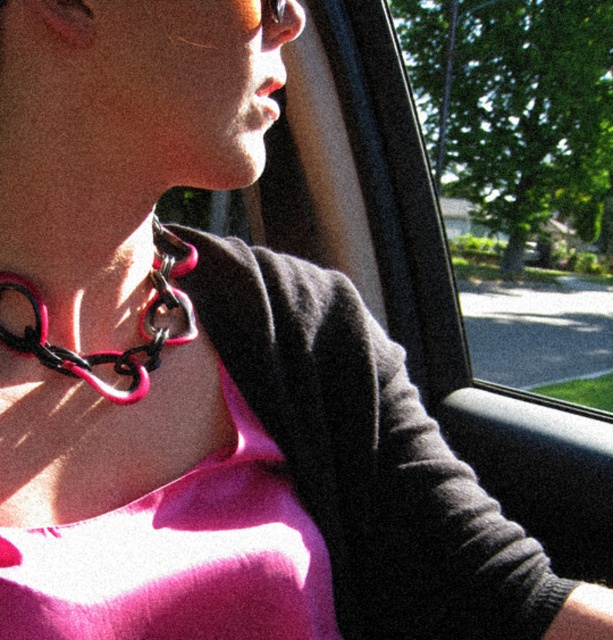
Question: Which point is closer to the camera?

Choices:
 (A) pink plastic chain at center
 (B) transparent glass at center

Answer: (A)

Question: Is transparent glass at center further to camera compared to pink plastic chain at center?

Choices:
 (A) yes
 (B) no

Answer: (A)

Question: Which of the following is the farthest from the observer?

Choices:
 (A) pink plastic chain at center
 (B) transparent glass at center

Answer: (B)

Question: Is transparent glass at center below pink plastic chain at center?

Choices:
 (A) yes
 (B) no

Answer: (B)

Question: Can you confirm if transparent glass at center is positioned above pink plastic chain at center?

Choices:
 (A) yes
 (B) no

Answer: (A)